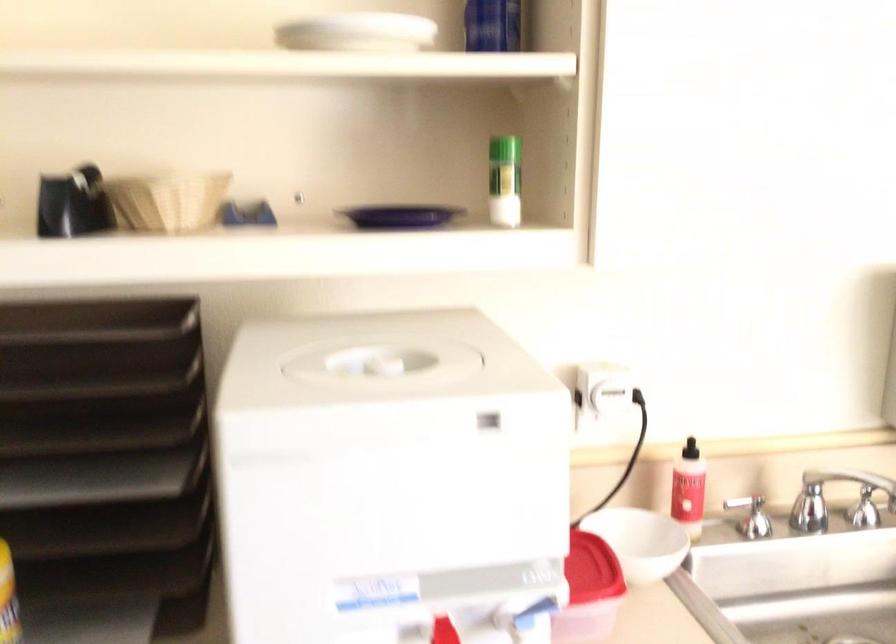
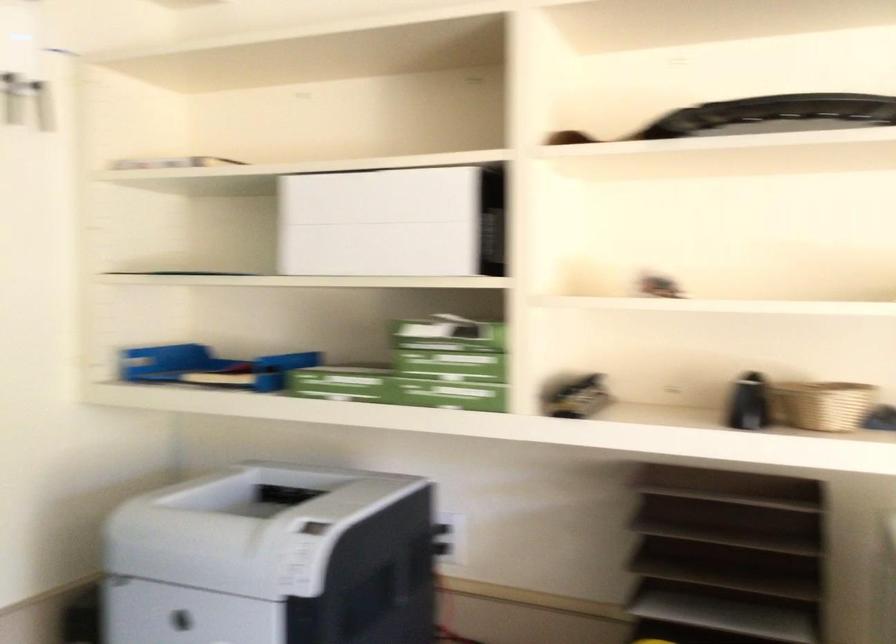
Question: Based on the continuous images, in which direction is the camera rotating? Reply with the corresponding letter.

Choices:
 (A) Left
 (B) Right
 (C) Up
 (D) Down

Answer: (A)